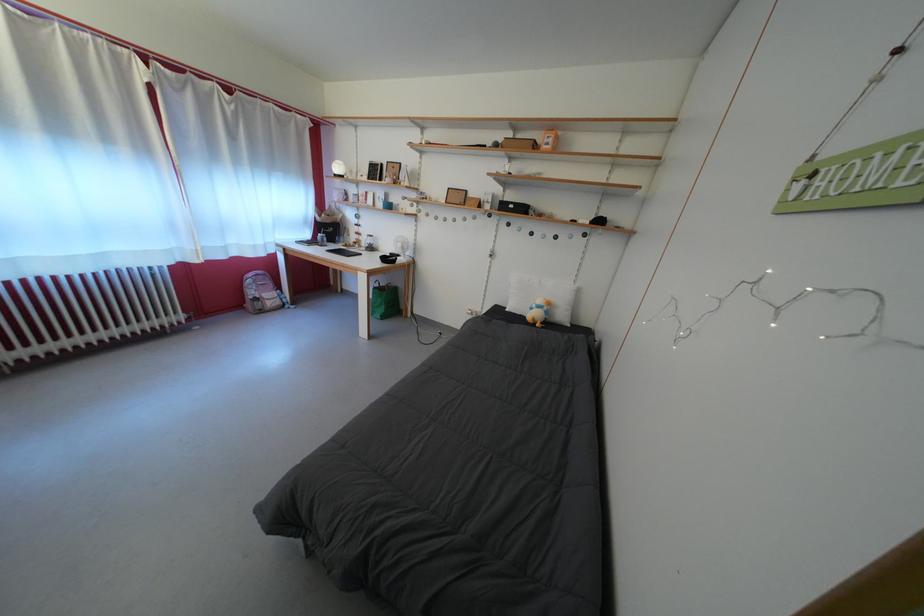
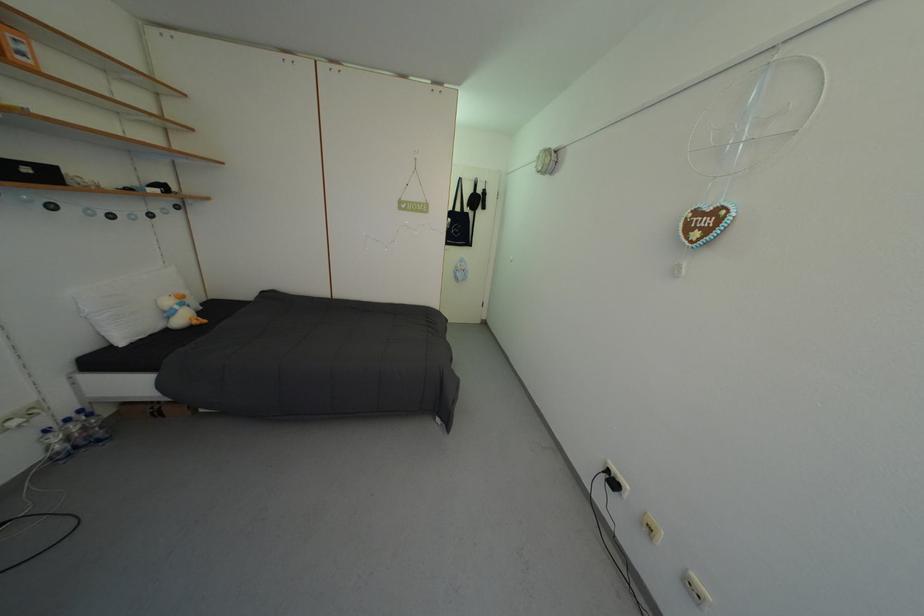
Find the pixel in the second image that matches point 519,213 in the first image.

(35, 176)